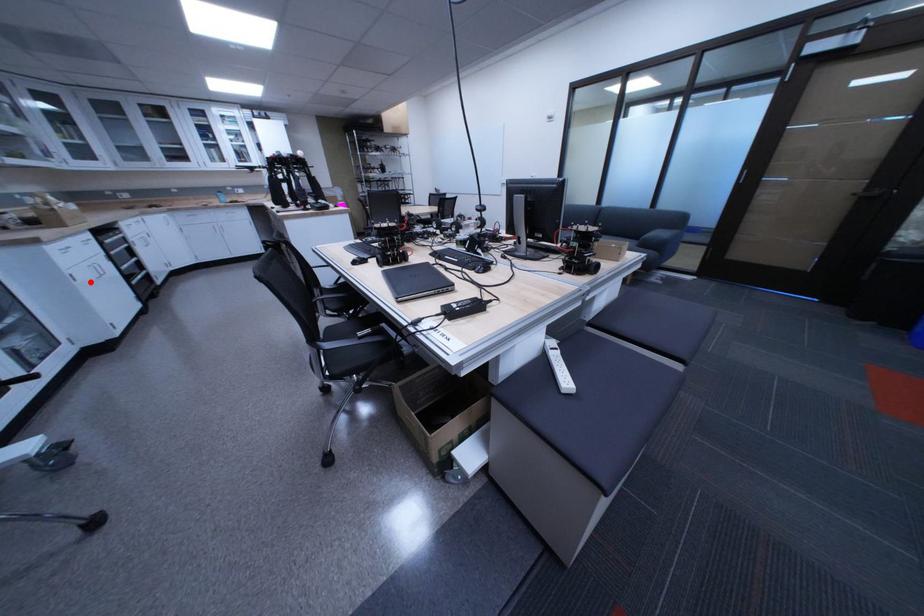
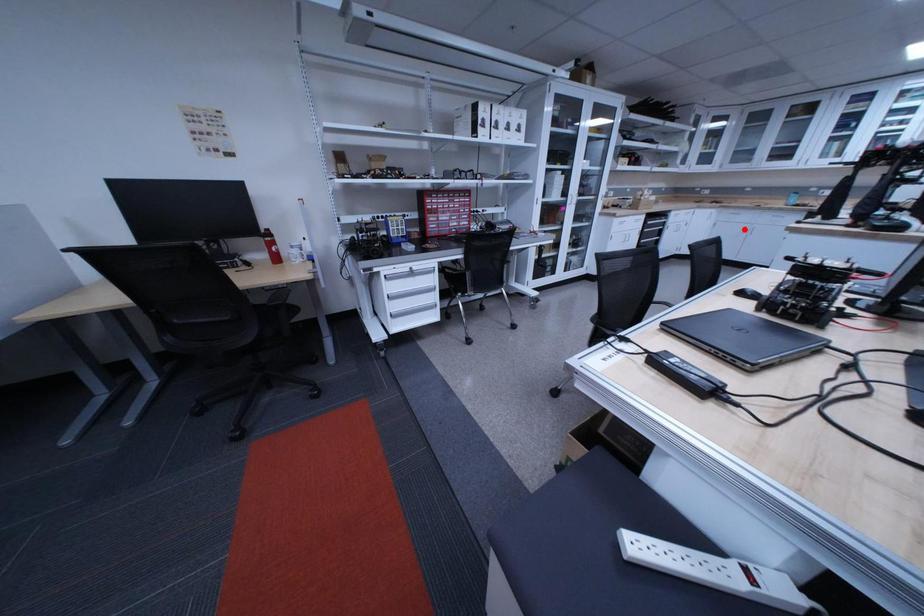
I am providing you with two images of the same scene from different viewpoints. A red point is marked on the first image and another point is marked on the second image. Does the point marked in image1 correspond to the same location as the one in image2?

No